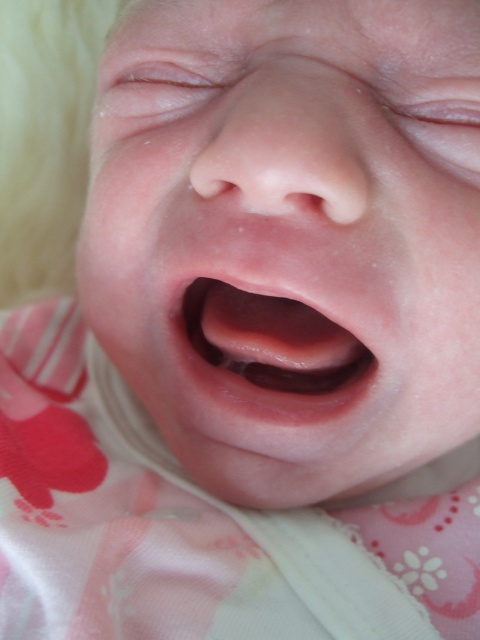
You are a photographer trying to capture a close shot of the baby. You notice two points in the image at coordinates point (x=478, y=410) and point (x=78, y=620). Which point is closer to the camera?

Point (x=78, y=620) is closer to the camera since point (x=478, y=410) is behind it.

You are a photographer taking a closeup shot of a baby. You notice two pink areas at the center of the image labeled as pink smooth skin at center and pink smooth flesh at center. Which one is positioned to the right side of the image?

The pink smooth skin at center is positioned to the right of the pink smooth flesh at center.

A baby is crying with their mouth open. If the distance between the baby and the point at point (305, 129) is 12.66 inches, can a parent reach the baby from that point to comfort them?

The distance between the baby and the point at point (305, 129) is 12.66 inches. Since the average adult arm span is about 30 inches, the parent can easily reach the baby from that point to comfort them.